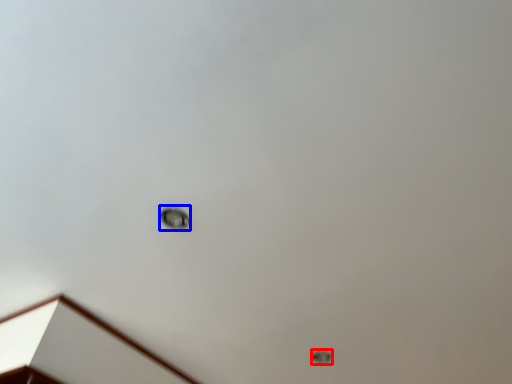
Question: Which point is further to the camera, lamp (highlighted by a red box) or dot (highlighted by a blue box)?

Choices:
 (A) lamp
 (B) dot

Answer: (A)